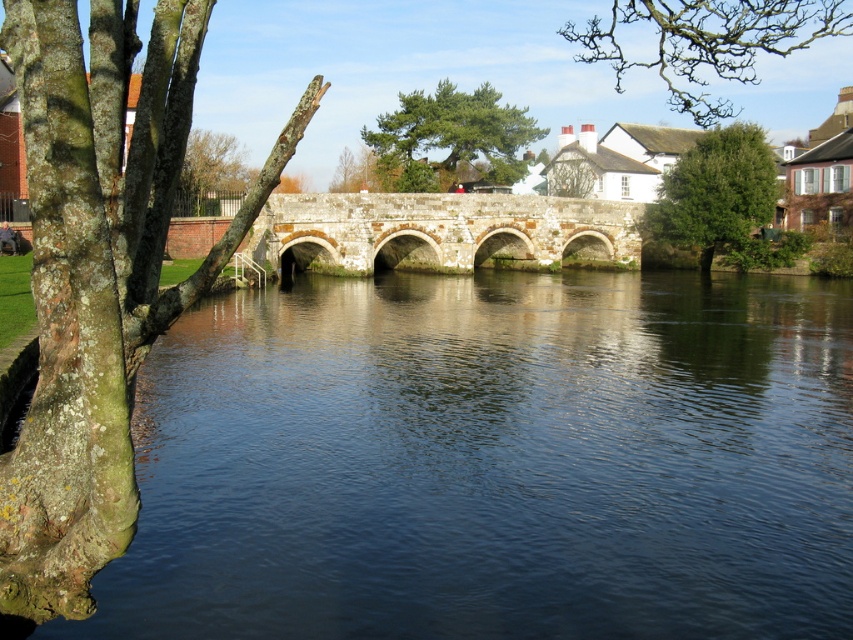
You are an artist sketching the historic stone bridge. You notice two green leafy trees in the scene. Which tree, the green leafy tree at right or the green leafy tree at center, is positioned lower in the image?

The green leafy tree at right is positioned lower than the green leafy tree at center because it is described as being below it.